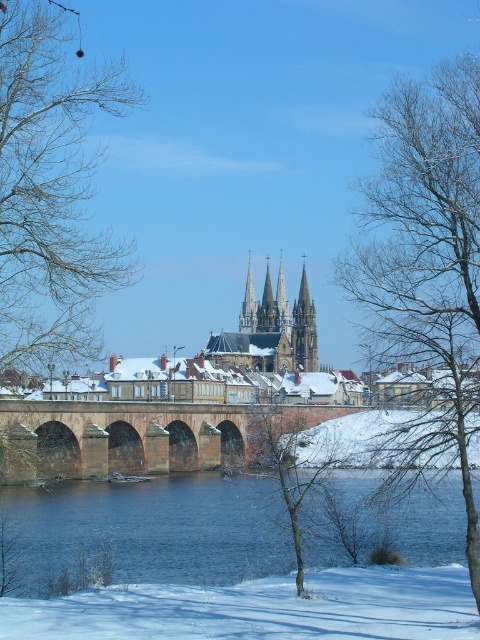
You are an architect analyzing the winter scene. You notice the bare branches at lower center and the smooth gray spire at center. Which structure is taller in this image?

The smooth gray spire at center is taller than the bare branches at lower center.

You are an artist sketching the cathedral scene. You need to draw the bare branches at left and the smooth gray spire at center. Which object should you draw first if you want to follow the natural left to right flow of the scene?

You should draw the bare branches at left first because it is positioned on the left side of the smooth gray spire at center, following the left to right flow.